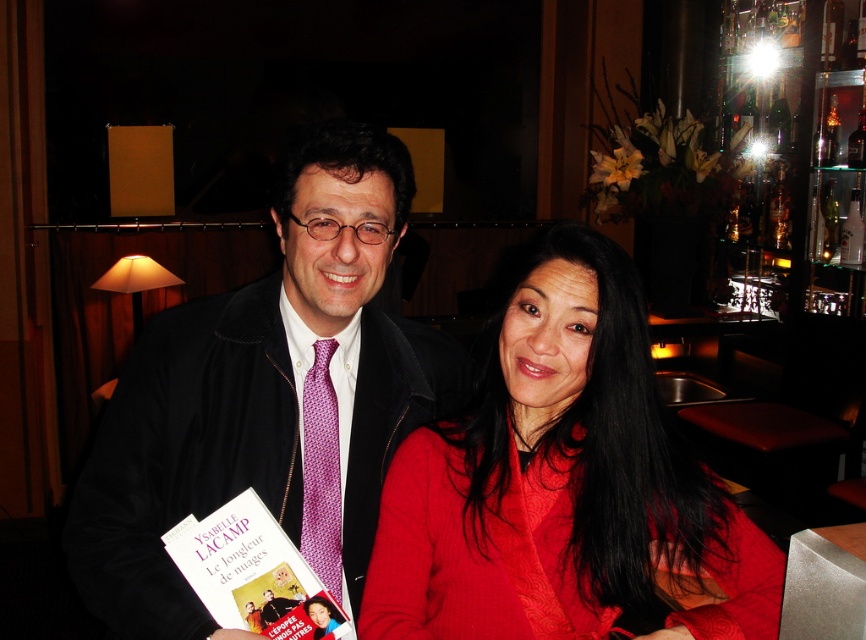
Does purple dotted tie at center appear on the right side of purple woven tie at center?

No, purple dotted tie at center is not to the right of purple woven tie at center.

From the picture: Is purple dotted tie at center above purple woven tie at center?

Indeed, purple dotted tie at center is positioned over purple woven tie at center.

Between point (81, 556) and point (335, 525), which one is positioned in front?

Positioned in front is point (81, 556).

At what (x,y) coordinates should I click in order to perform the action: click on purple dotted tie at center. Please return your answer as a coordinate pair (x, y). The height and width of the screenshot is (640, 866). Looking at the image, I should click on (267, 396).

Is matte purple book at center smaller than purple woven tie at center?

No, matte purple book at center is not smaller than purple woven tie at center.

Which is in front, point (325, 595) or point (307, 433)?

Point (325, 595) is more forward.

You are a GUI agent. You are given a task and a screenshot of the screen. Output one action in this format:
    pyautogui.click(x=<x>, y=<y>)
    Task: Click on the matte purple book at center
    
    Given the screenshot: What is the action you would take?
    pyautogui.click(x=253, y=573)

Which is more to the left, purple dotted tie at center or matte purple book at center?

matte purple book at center

Locate an element on the screen. purple dotted tie at center is located at coordinates pos(267,396).

Is point (154, 532) farther from viewer compared to point (320, 582)?

Yes.

At what (x,y) coordinates should I click in order to perform the action: click on purple dotted tie at center. Please return your answer as a coordinate pair (x, y). The width and height of the screenshot is (866, 640). Looking at the image, I should click on (267, 396).